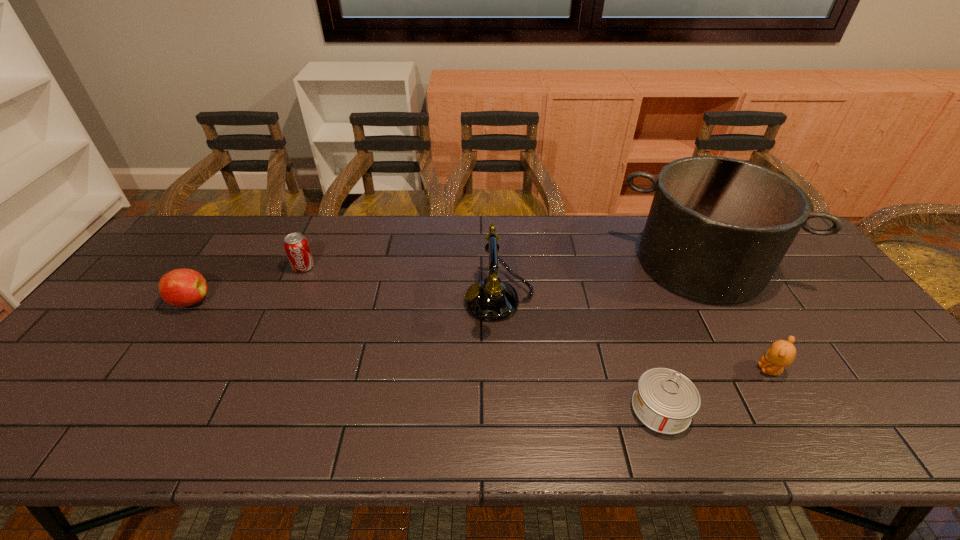
At what (x,y) coordinates should I click in order to perform the action: click on free spot that satisfies the following two spatial constraints: 1. on the back side of the soda; 2. on the left side of the pan. Please return your answer as a coordinate pair (x, y). This screenshot has width=960, height=540. Looking at the image, I should click on (305, 264).

This screenshot has height=540, width=960. I want to click on vacant space that satisfies the following two spatial constraints: 1. on the back side of the tallest object; 2. on the left side of the second object from left to right, so click(x=305, y=264).